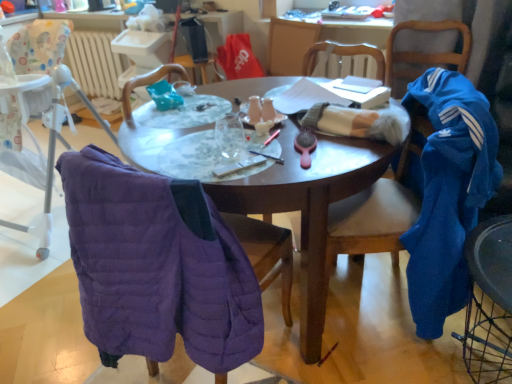
I want to click on free space in front of white fuzzy blanket at center, which is the 1th clothing in left-to-right order, so click(x=348, y=155).